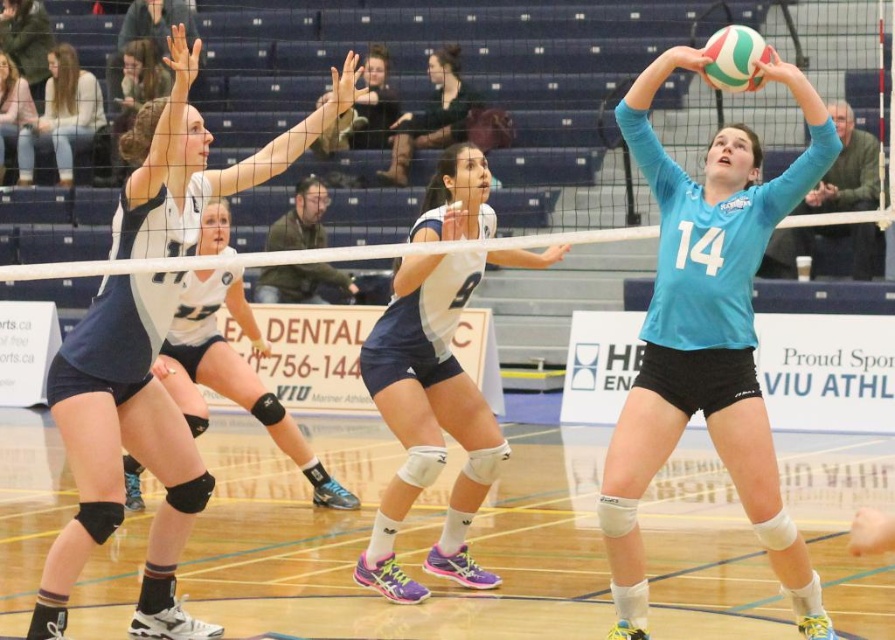
Between wooden floor at center and white matte volleyball at center, which one appears on the left side from the viewer's perspective?

wooden floor at center is more to the left.

Between point (760, 620) and point (471, 384), which one is positioned in front?

Positioned in front is point (760, 620).

Find the location of a particular element. This screenshot has width=895, height=640. wooden floor at center is located at coordinates (398, 541).

Can you confirm if white matte volleyball at center is smaller than matte white jersey at upper left?

Actually, white matte volleyball at center might be larger than matte white jersey at upper left.

Locate an element on the screen. Image resolution: width=895 pixels, height=640 pixels. white matte volleyball at center is located at coordinates (432, 413).

Does teal matte volleyball at center appear on the right side of matte white jersey at center?

Indeed, teal matte volleyball at center is positioned on the right side of matte white jersey at center.

Who is positioned more to the right, teal matte volleyball at center or matte white jersey at center?

Positioned to the right is teal matte volleyball at center.

Is point (629, 97) farther from camera compared to point (135, 166)?

No.

Locate an element on the screen. This screenshot has height=640, width=895. teal matte volleyball at center is located at coordinates (706, 337).